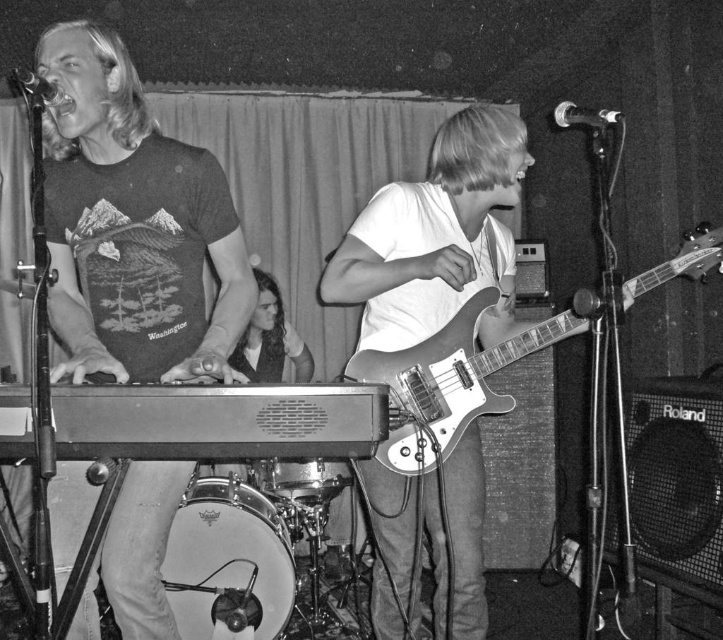
Question: Based on their relative distances, which object is nearer to the matte black keyboard at left?

Choices:
 (A) metallic drum at center
 (B) metallic silver guitar at center
 (C) white drumhead at lower center

Answer: (B)

Question: Estimate the real-world distances between objects in this image. Which object is closer to the metallic silver guitar at center?

Choices:
 (A) matte black keyboard at left
 (B) dark brown leather jacket at center
 (C) metallic drum at center
 (D) white drumhead at lower center

Answer: (A)

Question: Is metallic silver guitar at center to the left of white drumhead at lower center from the viewer's perspective?

Choices:
 (A) no
 (B) yes

Answer: (A)

Question: Based on their relative distances, which object is farther from the metallic silver guitar at center?

Choices:
 (A) metallic drum at center
 (B) matte black keyboard at left
 (C) dark brown leather jacket at center

Answer: (C)

Question: Does metallic silver guitar at center appear over dark brown leather jacket at center?

Choices:
 (A) no
 (B) yes

Answer: (B)

Question: Considering the relative positions of dark brown leather jacket at center and metallic drum at center in the image provided, where is dark brown leather jacket at center located with respect to metallic drum at center?

Choices:
 (A) above
 (B) below

Answer: (A)